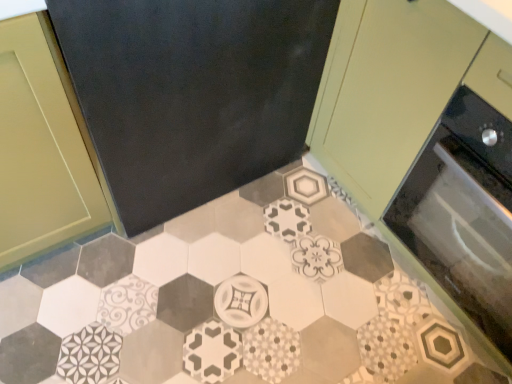
Question: Is patterned ceramic tile at center oriented away from black glass oven at right?

Choices:
 (A) yes
 (B) no

Answer: (B)

Question: Are patterned ceramic tile at center and black glass oven at right beside each other?

Choices:
 (A) yes
 (B) no

Answer: (B)

Question: Can you confirm if patterned ceramic tile at center is shorter than black glass oven at right?

Choices:
 (A) yes
 (B) no

Answer: (A)

Question: From the image's perspective, does patterned ceramic tile at center appear higher than black glass oven at right?

Choices:
 (A) no
 (B) yes

Answer: (A)

Question: Does patterned ceramic tile at center have a larger size compared to black glass oven at right?

Choices:
 (A) no
 (B) yes

Answer: (A)

Question: Is patterned ceramic tile at center smaller than black glass oven at right?

Choices:
 (A) yes
 (B) no

Answer: (A)

Question: Does matte green cabinet at upper right have a lesser width compared to patterned ceramic tile at center?

Choices:
 (A) no
 (B) yes

Answer: (B)

Question: Does matte green cabinet at upper right lie in front of patterned ceramic tile at center?

Choices:
 (A) yes
 (B) no

Answer: (A)

Question: From a real-world perspective, is matte green cabinet at upper right physically below patterned ceramic tile at center?

Choices:
 (A) no
 (B) yes

Answer: (A)

Question: Does matte green cabinet at upper right come behind patterned ceramic tile at center?

Choices:
 (A) no
 (B) yes

Answer: (A)

Question: Considering the relative sizes of matte green cabinet at upper right and patterned ceramic tile at center in the image provided, is matte green cabinet at upper right smaller than patterned ceramic tile at center?

Choices:
 (A) yes
 (B) no

Answer: (B)

Question: Can you confirm if matte green cabinet at upper right is shorter than patterned ceramic tile at center?

Choices:
 (A) yes
 (B) no

Answer: (B)

Question: From a real-world perspective, is patterned ceramic tile at center positioned over matte green cabinet at upper right based on gravity?

Choices:
 (A) no
 (B) yes

Answer: (A)